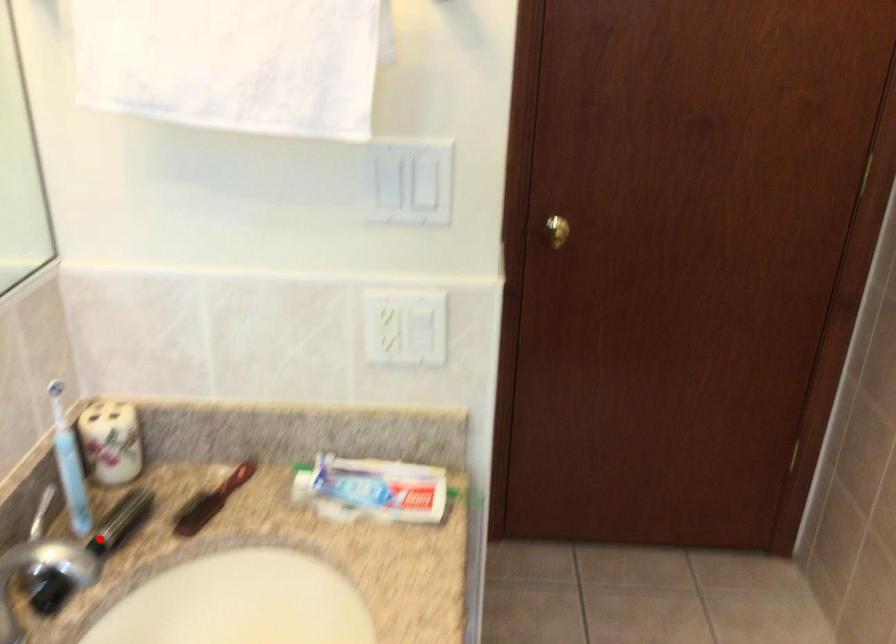
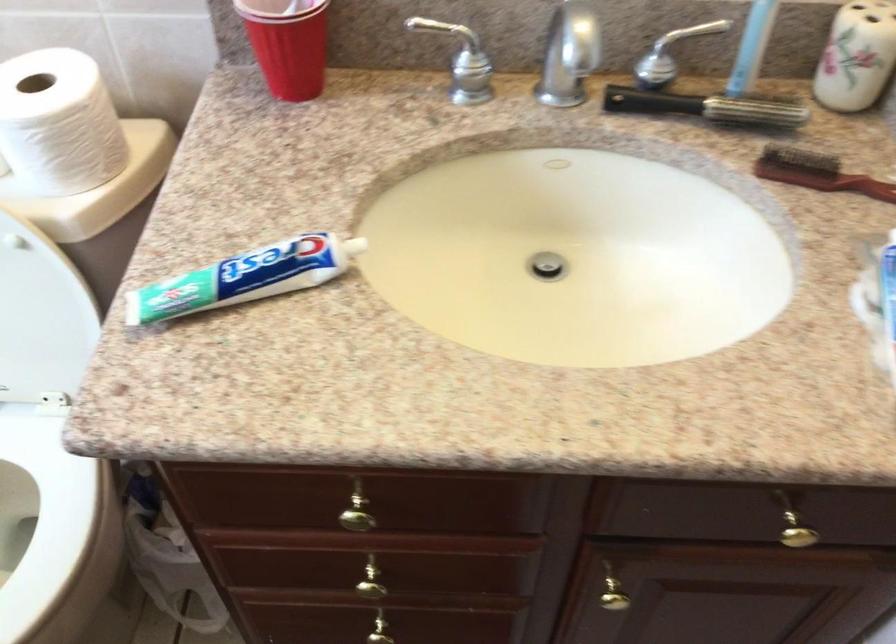
Question: I am providing you with two images of the same scene from different viewpoints. In image1, a red point is highlighted. Considering the same 3D point in image2, which of the following is correct?

Choices:
 (A) It is closer
 (B) It is farther

Answer: (A)